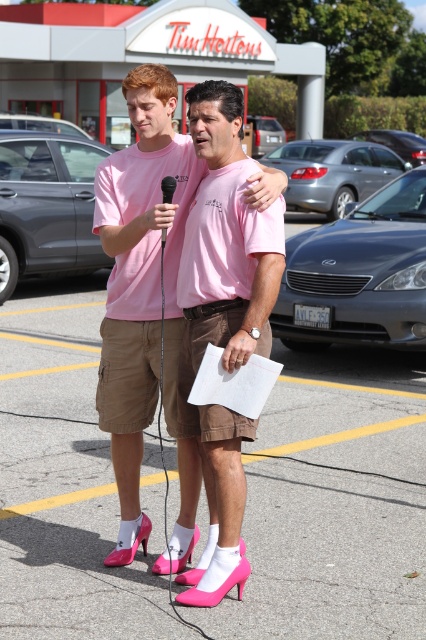
Between point (193, 502) and point (166, 177), which one is positioned in front?

Positioned in front is point (166, 177).

This screenshot has height=640, width=426. Describe the element at coordinates (141, 284) in the screenshot. I see `pink fabric shoes at center` at that location.

Locate an element on the screen. The image size is (426, 640). pink fabric shoes at center is located at coordinates (141, 284).